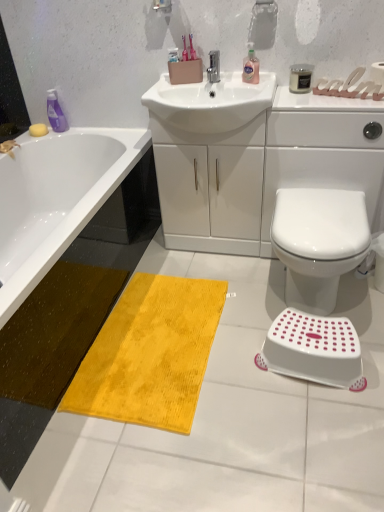
Question: From the image's perspective, is white glossy toilet at lower right on silver metallic faucet at center?

Choices:
 (A) no
 (B) yes

Answer: (A)

Question: Does white glossy toilet at lower right lie in front of silver metallic faucet at center?

Choices:
 (A) no
 (B) yes

Answer: (B)

Question: Is white glossy toilet at lower right facing towards silver metallic faucet at center?

Choices:
 (A) no
 (B) yes

Answer: (A)

Question: From a real-world perspective, is white glossy toilet at lower right on top of silver metallic faucet at center?

Choices:
 (A) yes
 (B) no

Answer: (B)

Question: Would you say white glossy toilet at lower right contains silver metallic faucet at center?

Choices:
 (A) no
 (B) yes

Answer: (A)

Question: Looking at the image, does yellow sponge at upper left seem bigger or smaller compared to white plastic step stool at lower right?

Choices:
 (A) big
 (B) small

Answer: (B)

Question: Is yellow sponge at upper left inside or outside of white plastic step stool at lower right?

Choices:
 (A) outside
 (B) inside

Answer: (A)

Question: In the image, is yellow sponge at upper left on the left side or the right side of white plastic step stool at lower right?

Choices:
 (A) left
 (B) right

Answer: (A)

Question: From a real-world perspective, is yellow sponge at upper left physically located above or below white plastic step stool at lower right?

Choices:
 (A) below
 (B) above

Answer: (B)

Question: From the image's perspective, is yellow plush mat at lower left located above or below yellow plush bath mat at center?

Choices:
 (A) above
 (B) below

Answer: (A)

Question: Is point (18, 349) positioned closer to the camera than point (147, 366)?

Choices:
 (A) farther
 (B) closer

Answer: (B)

Question: Would you say yellow plush mat at lower left is to the left or to the right of yellow plush bath mat at center in the picture?

Choices:
 (A) right
 (B) left

Answer: (B)

Question: From a real-world perspective, relative to yellow plush bath mat at center, is yellow plush mat at lower left vertically above or below?

Choices:
 (A) below
 (B) above

Answer: (B)

Question: Considering the positions of satin black candle at upper right and purple plastic bottle at upper left, the second cleaning product viewed from the front, in the image, is satin black candle at upper right taller or shorter than purple plastic bottle at upper left, the second cleaning product viewed from the front,?

Choices:
 (A) short
 (B) tall

Answer: (A)

Question: Considering the positions of satin black candle at upper right and purple plastic bottle at upper left, the second cleaning product viewed from the front, in the image, is satin black candle at upper right wider or thinner than purple plastic bottle at upper left, the second cleaning product viewed from the front,?

Choices:
 (A) thin
 (B) wide

Answer: (B)